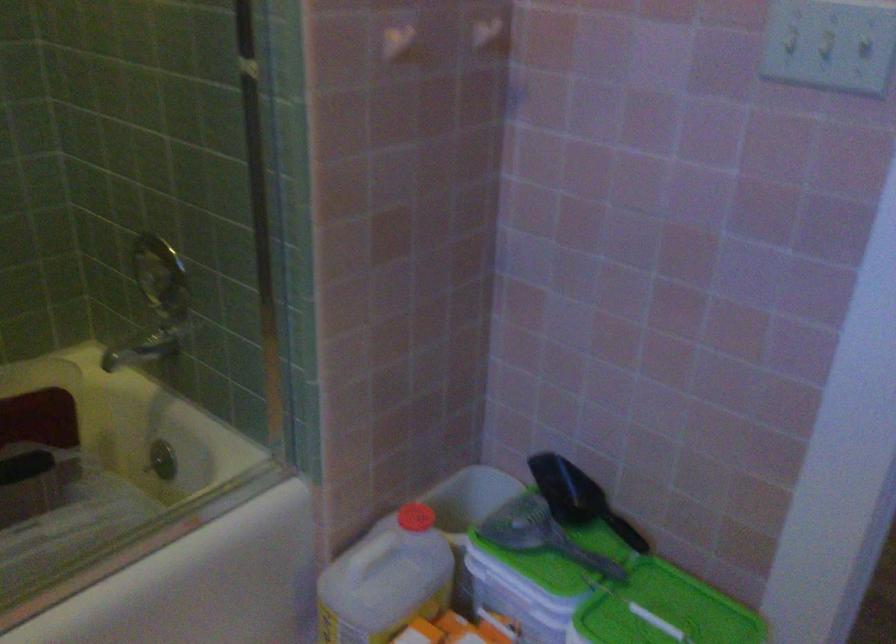
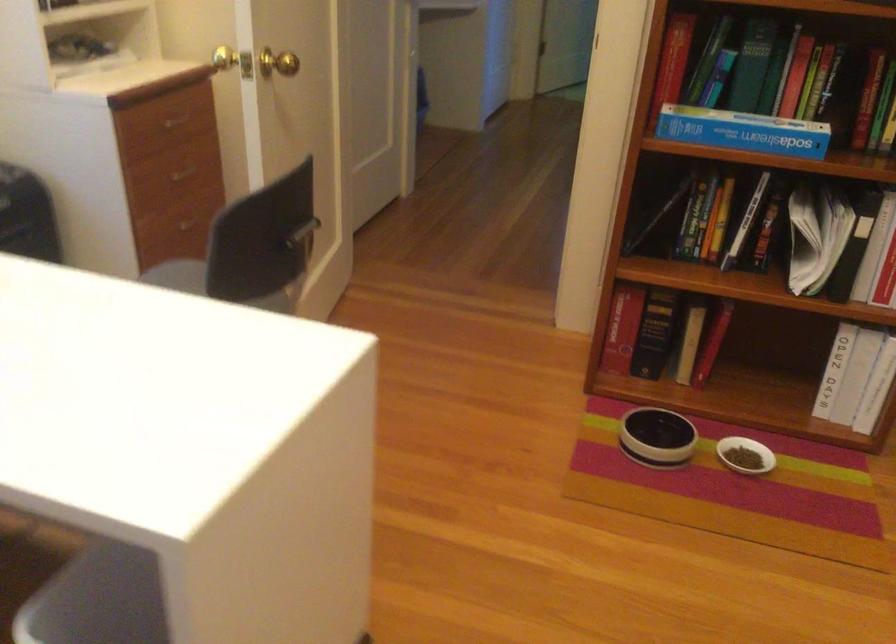
Question: I am providing you with two images of the same scene from different viewpoints. After the viewpoint changes to image2, which objects are now occluded?

Choices:
 (A) silver diverter knob
 (B) small white bowl
 (C) black book
 (D) red bottle cap

Answer: (D)